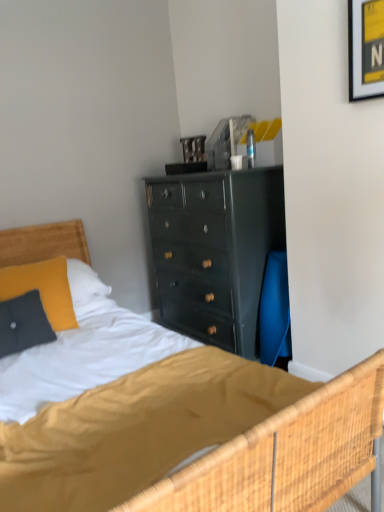
Question: From a real-world perspective, is velvety yellow pillow at left above or below yellow paper at upper right?

Choices:
 (A) above
 (B) below

Answer: (B)

Question: In terms of width, does velvety yellow pillow at left look wider or thinner when compared to yellow paper at upper right?

Choices:
 (A) wide
 (B) thin

Answer: (A)

Question: Which object is positioned farthest from the velvety yellow pillow at left?

Choices:
 (A) yellow paper at upper right
 (B) wooden headboard at left

Answer: (A)

Question: Which object is the closest to the wooden headboard at left?

Choices:
 (A) velvety yellow pillow at left
 (B) yellow paper at upper right

Answer: (A)